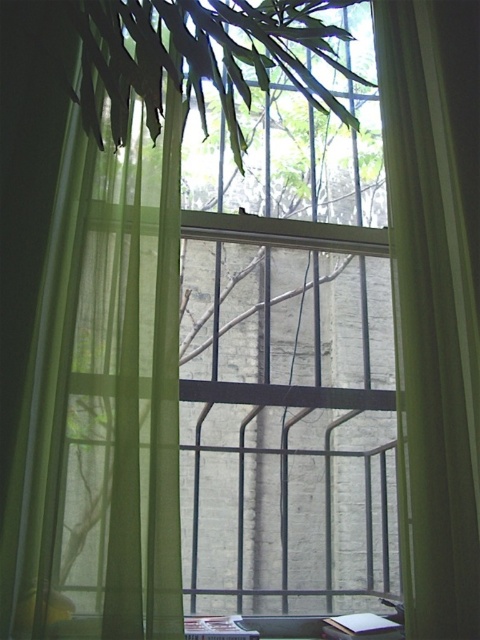
What do you see at coordinates (85, 358) in the screenshot? I see `green sheer curtain at left` at bounding box center [85, 358].

Does green sheer curtain at left lie behind white paper at bottom center?

No, green sheer curtain at left is closer to the viewer.

Is point (54, 563) positioned after point (228, 636)?

No.

You are a GUI agent. You are given a task and a screenshot of the screen. Output one action in this format:
    pyautogui.click(x=<x>, y=<y>)
    Task: Click on the green sheer curtain at left
    The height and width of the screenshot is (640, 480).
    Given the screenshot: What is the action you would take?
    pyautogui.click(x=85, y=358)

Can you confirm if green sheer curtain at left is positioned above white paper book at bottom right?

Correct, green sheer curtain at left is located above white paper book at bottom right.

Identify the location of green sheer curtain at left. (85, 358).

This screenshot has height=640, width=480. Describe the element at coordinates (85, 358) in the screenshot. I see `green sheer curtain at left` at that location.

Identify the location of green sheer curtain at left. (85, 358).

Is white paper book at bottom right above white paper at bottom center?

Actually, white paper book at bottom right is below white paper at bottom center.

Between white paper book at bottom right and white paper at bottom center, which one appears on the right side from the viewer's perspective?

Positioned to the right is white paper book at bottom right.

The height and width of the screenshot is (640, 480). What do you see at coordinates (361, 627) in the screenshot?
I see `white paper book at bottom right` at bounding box center [361, 627].

Where is `white paper book at bottom right`? This screenshot has width=480, height=640. white paper book at bottom right is located at coordinates (361, 627).